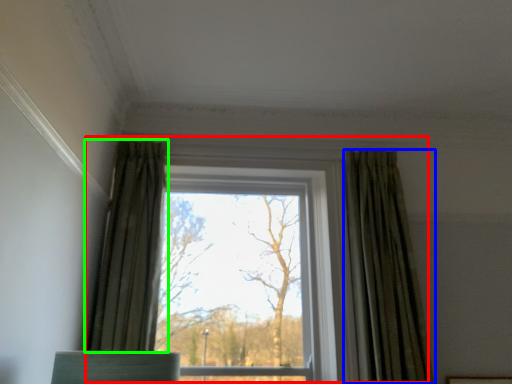
Question: Considering the real-world distances, which object is farthest from window (highlighted by a red box)? curtain (highlighted by a blue box) or curtain (highlighted by a green box)?

Choices:
 (A) curtain
 (B) curtain

Answer: (B)